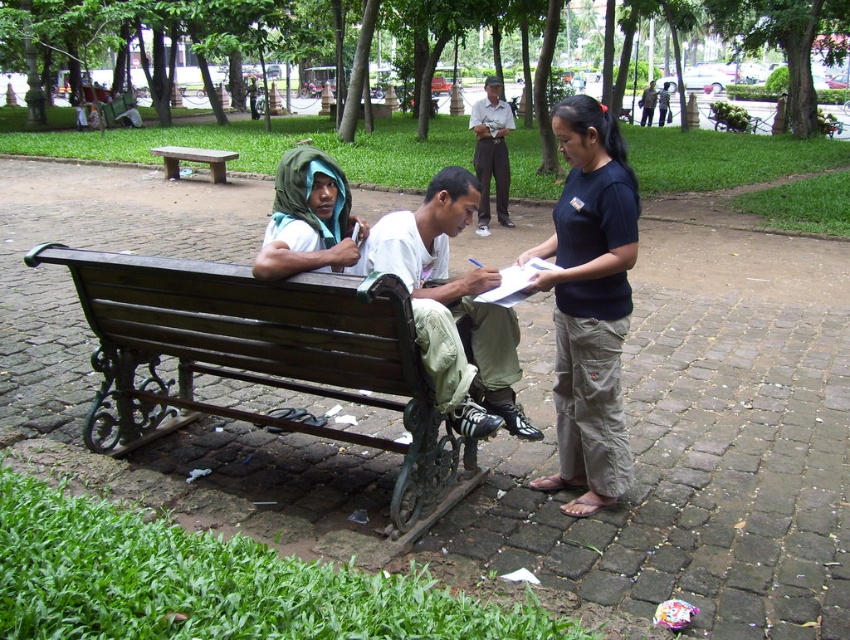
Which of these two, dark blue cotton shirt at center or white t-shirt at center, stands shorter?

white t-shirt at center is shorter.

Based on the photo, who is taller, dark blue cotton shirt at center or white t-shirt at center?

dark blue cotton shirt at center

Which is in front, point (553, 285) or point (477, 404)?

Point (553, 285)

The width and height of the screenshot is (850, 640). I want to click on dark blue cotton shirt at center, so click(588, 304).

This screenshot has height=640, width=850. Describe the element at coordinates (588, 304) in the screenshot. I see `dark blue cotton shirt at center` at that location.

Does dark blue cotton shirt at center have a larger size compared to brown wooden bench at center?

Actually, dark blue cotton shirt at center might be smaller than brown wooden bench at center.

I want to click on dark blue cotton shirt at center, so click(x=588, y=304).

The width and height of the screenshot is (850, 640). I want to click on dark blue cotton shirt at center, so click(x=588, y=304).

Does matte green headscarf at center have a lesser width compared to brown wooden bench at center?

Correct, matte green headscarf at center's width is less than brown wooden bench at center's.

Who is more distant from viewer, (298, 212) or (210, 163)?

Point (210, 163)

Who is more distant from viewer, [292,156] or [208,168]?

The point [208,168] is behind.

Where is `matte green headscarf at center`? The image size is (850, 640). matte green headscarf at center is located at coordinates click(x=309, y=218).